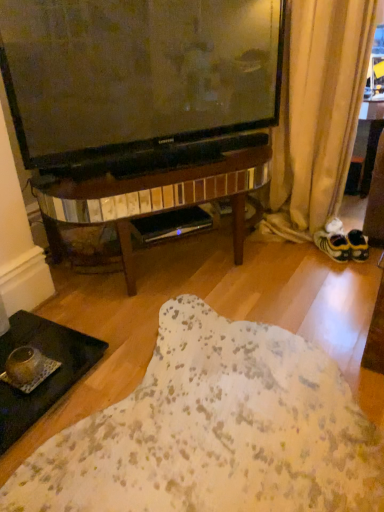
Question: Is beige fabric curtain at lower right facing away from yellow fabric shoe at right?

Choices:
 (A) no
 (B) yes

Answer: (A)

Question: From a real-world perspective, is beige fabric curtain at lower right under yellow fabric shoe at right?

Choices:
 (A) yes
 (B) no

Answer: (B)

Question: Does beige fabric curtain at lower right contain yellow fabric shoe at right?

Choices:
 (A) no
 (B) yes

Answer: (B)

Question: Does beige fabric curtain at lower right turn towards yellow fabric shoe at right?

Choices:
 (A) yes
 (B) no

Answer: (A)

Question: Can you confirm if beige fabric curtain at lower right is wider than yellow fabric shoe at right?

Choices:
 (A) no
 (B) yes

Answer: (B)

Question: Does point (1, 394) appear closer or farther from the camera than point (329, 236)?

Choices:
 (A) farther
 (B) closer

Answer: (B)

Question: From a real-world perspective, is black glass tray at lower left physically located above or below yellow fabric shoe at right?

Choices:
 (A) above
 (B) below

Answer: (B)

Question: From the image's perspective, relative to yellow fabric shoe at right, is black glass tray at lower left above or below?

Choices:
 (A) below
 (B) above

Answer: (A)

Question: Is black glass tray at lower left inside the boundaries of yellow fabric shoe at right, or outside?

Choices:
 (A) outside
 (B) inside

Answer: (A)

Question: From their relative heights in the image, would you say yellow fabric shoe at right is taller or shorter than black glass tray at lower left?

Choices:
 (A) tall
 (B) short

Answer: (A)

Question: From the image's perspective, relative to black glass tray at lower left, is yellow fabric shoe at right above or below?

Choices:
 (A) below
 (B) above

Answer: (B)

Question: In the image, is yellow fabric shoe at right positioned in front of or behind black glass tray at lower left?

Choices:
 (A) front
 (B) behind

Answer: (B)

Question: In terms of width, does yellow fabric shoe at right look wider or thinner when compared to black glass tray at lower left?

Choices:
 (A) wide
 (B) thin

Answer: (B)

Question: Is beige fabric curtain at lower right spatially inside black glass tray at lower left, or outside of it?

Choices:
 (A) inside
 (B) outside

Answer: (B)

Question: Considering the relative positions of beige fabric curtain at lower right and black glass tray at lower left in the image provided, is beige fabric curtain at lower right to the left or to the right of black glass tray at lower left?

Choices:
 (A) right
 (B) left

Answer: (A)